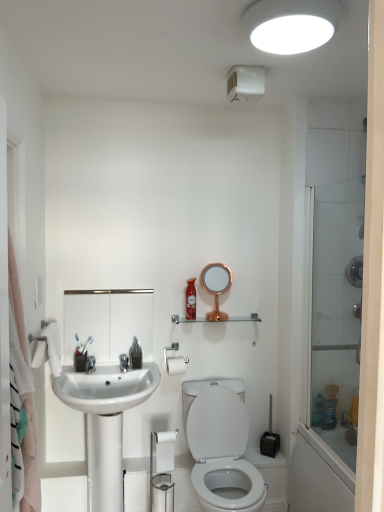
Question: Considering the positions of white matte toilet paper at center, the first toilet paper viewed from the back, and transparent glass shower door at right in the image, is white matte toilet paper at center, the first toilet paper viewed from the back, wider or thinner than transparent glass shower door at right?

Choices:
 (A) thin
 (B) wide

Answer: (B)

Question: From a real-world perspective, is white matte toilet paper at center, the first toilet paper viewed from the back, positioned above or below transparent glass shower door at right?

Choices:
 (A) above
 (B) below

Answer: (B)

Question: Which object is the closest to the matte glass bottle at center?

Choices:
 (A) white matte toilet paper at center, positioned as the 2th toilet paper in bottom-to-top order
 (B) white glossy toilet at lower center
 (C) transparent glass shower door at right
 (D) clear glass shelf at center
 (E) white glossy medicine cabinet at upper center

Answer: (D)

Question: Estimate the real-world distances between objects in this image. Which object is closer to the white soft towel at left?

Choices:
 (A) white matte light fixture at upper center
 (B) white glossy medicine cabinet at upper center
 (C) white matte toilet paper at center, positioned as the 2th toilet paper in bottom-to-top order
 (D) white glossy toilet at lower center
 (E) white fabric shower curtain at left

Answer: (B)